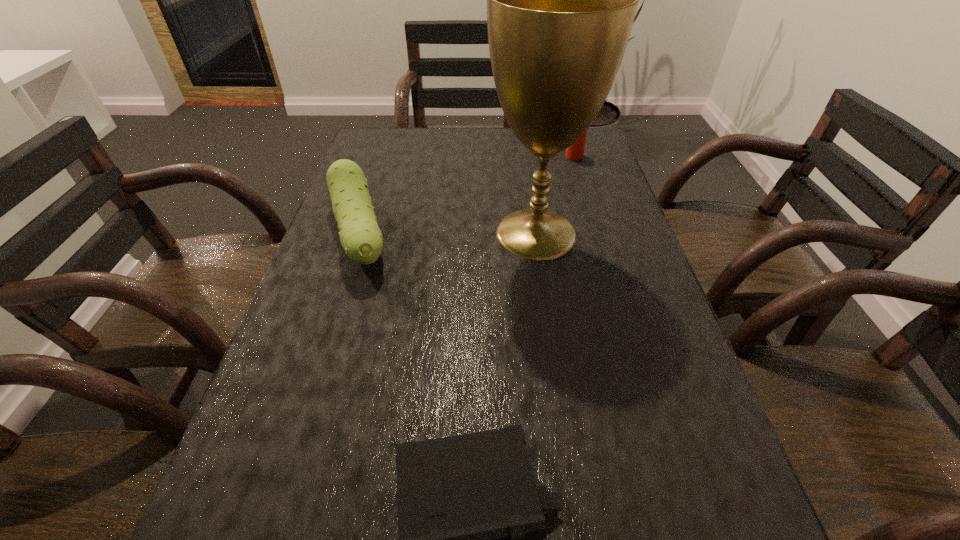
This screenshot has width=960, height=540. What are the coordinates of `vacant area that lies between the trophy cup and the Tabasco sauce` in the screenshot? It's located at (555, 195).

Find the location of a particular element. vacant area between the third tallest object and the third shortest object is located at coordinates (467, 196).

Locate an element on the screen. vacant space that's between the rightmost object and the trophy cup is located at coordinates (555, 195).

I want to click on vacant space in between the tallest object and the third tallest object, so click(447, 234).

Choose which object is the nearest neighbor to the shortest object. Please provide its 2D coordinates. Your answer should be formatted as a tuple, i.e. [(x, y)], where the tuple contains the x and y coordinates of a point satisfying the conditions above.

[(360, 236)]

Identify the location of the second closest object to the tallest object. (575, 152).

Locate an element on the screen. The width and height of the screenshot is (960, 540). free spot that satisfies the following two spatial constraints: 1. on the back side of the cucumber; 2. on the right side of the rightmost object is located at coordinates 384,156.

Image resolution: width=960 pixels, height=540 pixels. Identify the location of vacant region that satisfies the following two spatial constraints: 1. on the back side of the tallest object; 2. on the left side of the second tallest object. point(524,156).